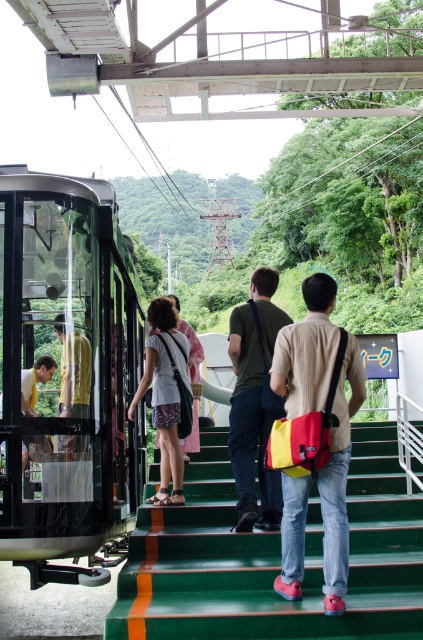
Question: Can you confirm if green fabric shirt at center is thinner than matte black shirt at left?

Choices:
 (A) yes
 (B) no

Answer: (A)

Question: Is green fabric shirt at center positioned behind matte black shirt at left?

Choices:
 (A) yes
 (B) no

Answer: (A)

Question: Can you confirm if green fabric shirt at center is thinner than yellow matte shirt at center?

Choices:
 (A) yes
 (B) no

Answer: (B)

Question: Which is nearer to the white cotton shirt at center?

Choices:
 (A) transparent glass bus at left
 (B) yellow/red fabric bag at center

Answer: (A)

Question: Which of these objects is positioned closest to the green fabric shirt at center?

Choices:
 (A) green rubber stairs at center
 (B) yellow/red fabric bag at center

Answer: (A)

Question: Estimate the real-world distances between objects in this image. Which object is farther from the yellow/red fabric bag at center?

Choices:
 (A) yellow matte shirt at center
 (B) matte black shirt at left

Answer: (B)